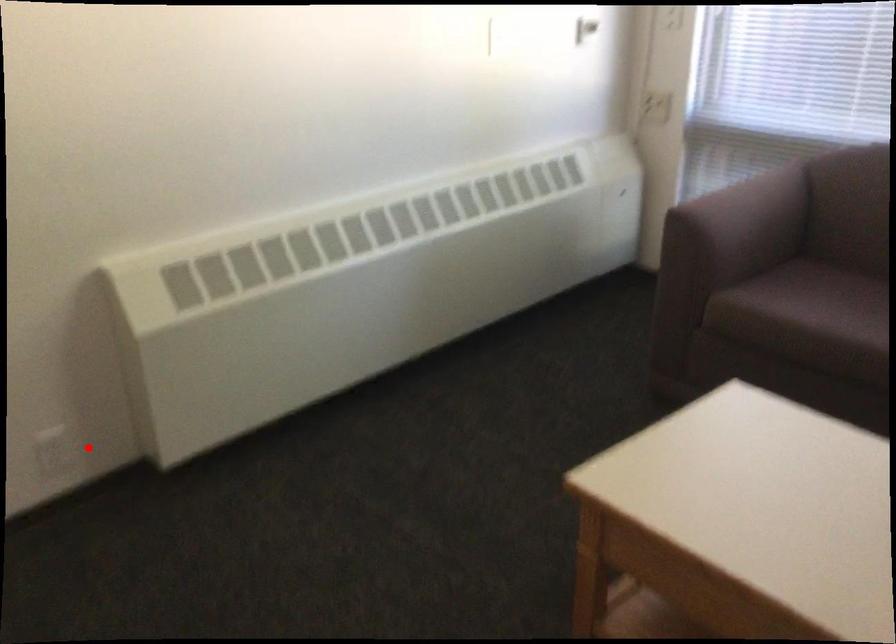
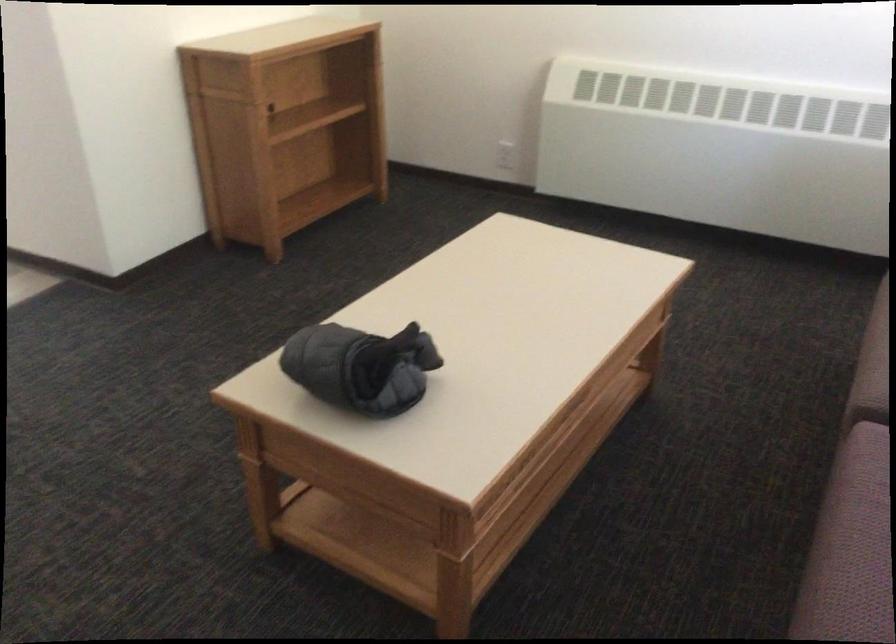
Question: A red point is marked in image1. In image2, is the corresponding 3D point closer to the camera or farther? Reply with the corresponding letter.

Choices:
 (A) The corresponding 3D point is closer.
 (B) The corresponding 3D point is farther.

Answer: (B)